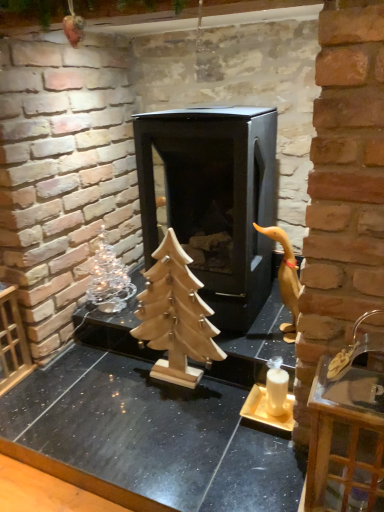
At what (x,y) coordinates should I click in order to perform the action: click on free space in front of wooden christmas tree at center. Please return your answer as a coordinate pair (x, y). Looking at the image, I should click on (170, 421).